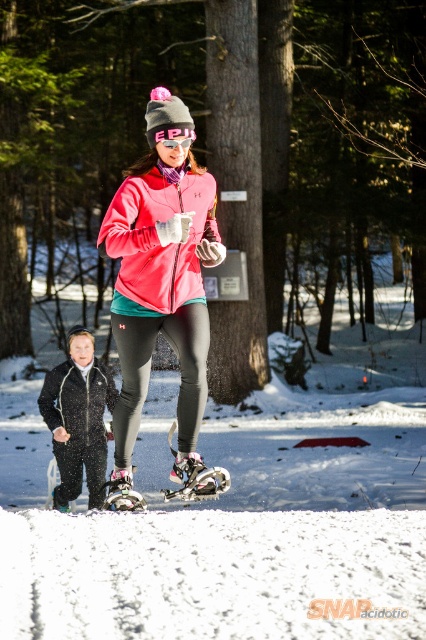
Is the position of black fleece jacket at lower left less distant than that of transparent plastic goggles at center?

No, it is not.

Is point (103, 380) less distant than point (183, 147)?

That is False.

This screenshot has width=426, height=640. Find the location of `black fleece jacket at lower left`. black fleece jacket at lower left is located at coordinates (77, 401).

Where is `matte pink jacket at center`? matte pink jacket at center is located at coordinates (164, 284).

Does point (126, 264) lie in front of point (169, 276)?

That is False.

Is point (158, 284) behind point (135, 289)?

Yes, point (158, 284) is behind point (135, 289).

You are a GUI agent. You are given a task and a screenshot of the screen. Output one action in this format:
    pyautogui.click(x=<x>, y=<y>)
    Task: Click on the matte pink jacket at center
    This screenshot has height=640, width=426.
    Given the screenshot: What is the action you would take?
    pyautogui.click(x=164, y=284)

Based on the photo, can you confirm if pink fleece jacket at center is wider than brushed metal snowshoe at lower center?

Yes.

Can you confirm if pink fleece jacket at center is positioned above brushed metal snowshoe at lower center?

Yes.

Who is more forward, [210,180] or [124,508]?

Positioned in front is point [210,180].

Identify the location of pink fleece jacket at center. This screenshot has height=640, width=426. (157, 237).